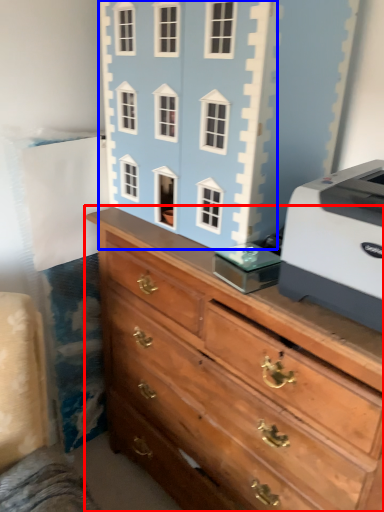
Question: Which object appears farthest to the camera in this image, chest of drawers (highlighted by a red box) or toy (highlighted by a blue box)?

Choices:
 (A) chest of drawers
 (B) toy

Answer: (B)